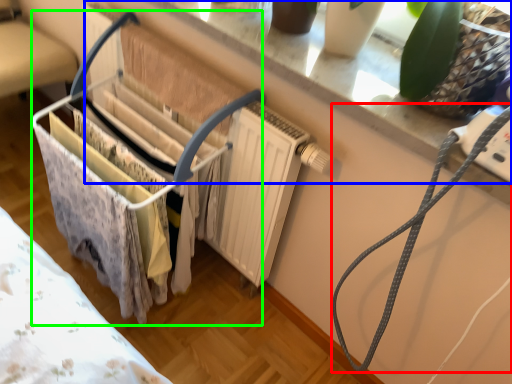
Question: Which is nearer to the string (highlighted by a red box)? window sill (highlighted by a blue box) or baby carriage (highlighted by a green box).

Choices:
 (A) window sill
 (B) baby carriage

Answer: (A)